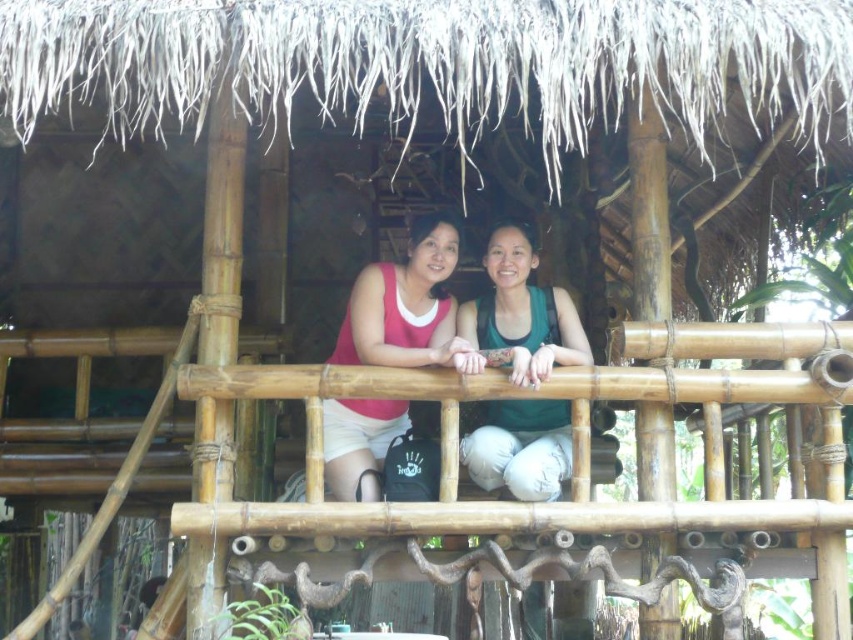
You are a fashion designer observing two people on a bamboo balcony. You notice the green matte tank top at center and the matte pink tank top at center. Which tank top has a bigger size?

The green matte tank top at center has a larger size compared to the matte pink tank top at center.

You are a photographer taking a picture of two people on a balcony. You notice the green matte tank top at center and the matte pink tank top at center. Which tank top is on the right side when looking at the image from the front?

The green matte tank top at center is positioned on the right side of the matte pink tank top at center, so the green one is on the right.